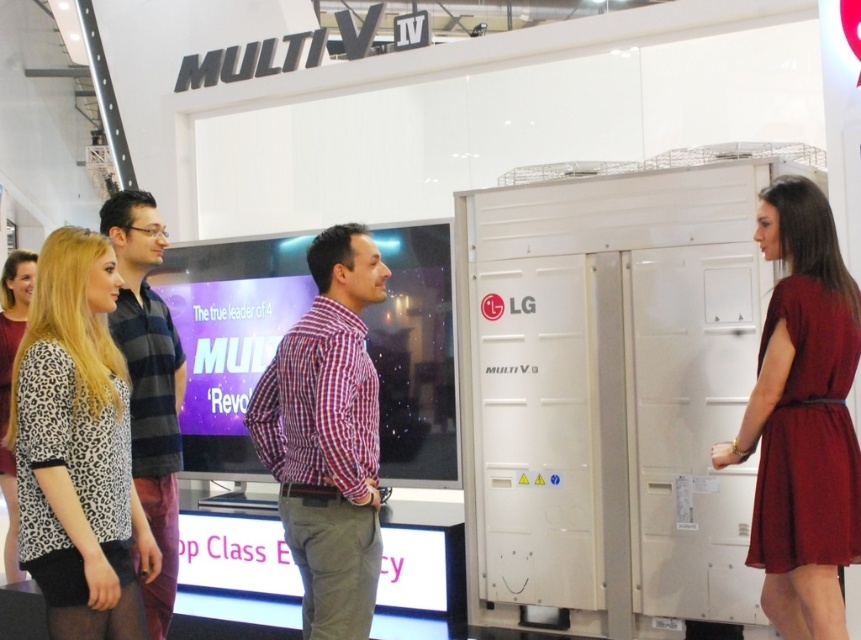
Question: Does red checkered shirt at center come behind leopard print dress at lower left?

Choices:
 (A) yes
 (B) no

Answer: (B)

Question: Is leopard print blouse at center further to the viewer compared to burgundy satin dress at right?

Choices:
 (A) yes
 (B) no

Answer: (B)

Question: Which of the following is the farthest from the observer?

Choices:
 (A) (781, 212)
 (B) (166, 616)
 (C) (129, 548)
 (D) (360, 292)

Answer: (B)

Question: Which object is closer to the camera taking this photo?

Choices:
 (A) plaid shirt at left
 (B) leopard print dress at lower left

Answer: (A)

Question: Based on their relative distances, which object is farther from the leopard print blouse at center?

Choices:
 (A) burgundy satin dress at right
 (B) red checkered shirt at center

Answer: (A)

Question: Is leopard print blouse at center to the right of red checkered shirt at center from the viewer's perspective?

Choices:
 (A) yes
 (B) no

Answer: (B)